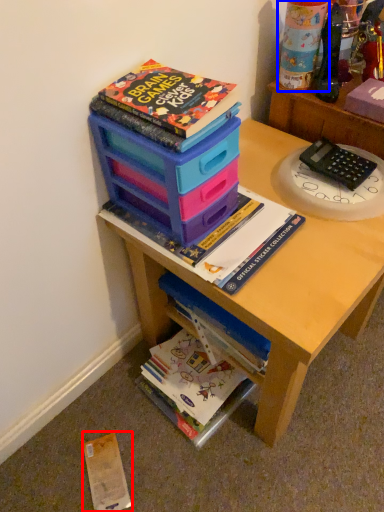
Question: Among these objects, which one is nearest to the camera, paperback book (highlighted by a red box) or toy (highlighted by a blue box)?

Choices:
 (A) paperback book
 (B) toy

Answer: (B)